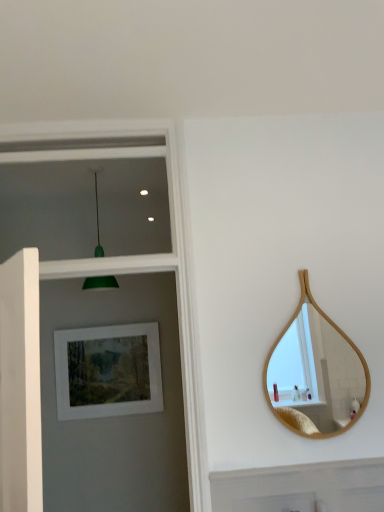
Question: Is green matte pendant light at upper left wider or thinner than matte white picture frame at upper left?

Choices:
 (A) wide
 (B) thin

Answer: (A)

Question: From a real-world perspective, is green matte pendant light at upper left positioned above or below matte white picture frame at upper left?

Choices:
 (A) below
 (B) above

Answer: (B)

Question: Which of these objects is positioned farthest from the bamboo mirror at right?

Choices:
 (A) green matte pendant light at upper left
 (B) matte white picture frame at upper left

Answer: (A)

Question: Estimate the real-world distances between objects in this image. Which object is closer to the matte white picture frame at upper left?

Choices:
 (A) green matte pendant light at upper left
 (B) bamboo mirror at right

Answer: (A)